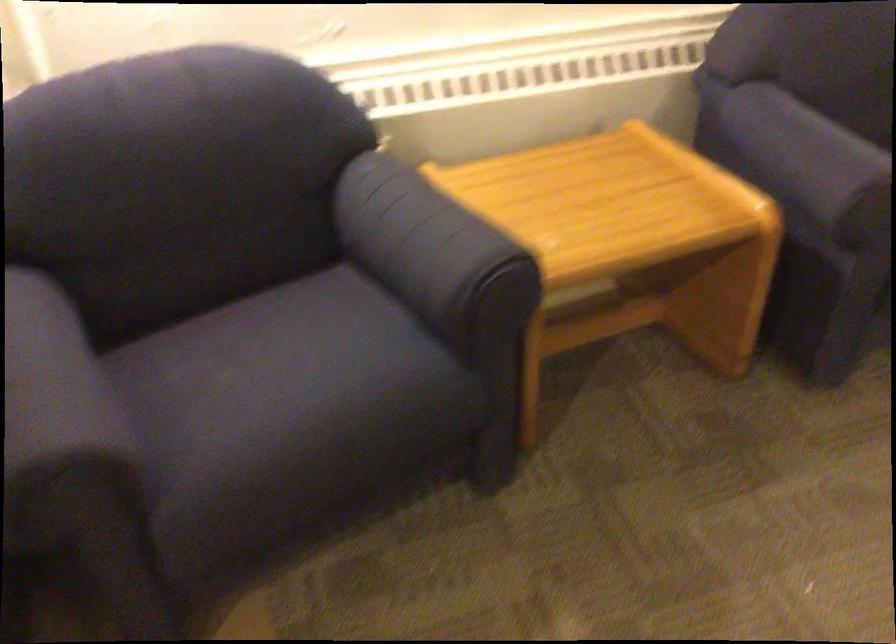
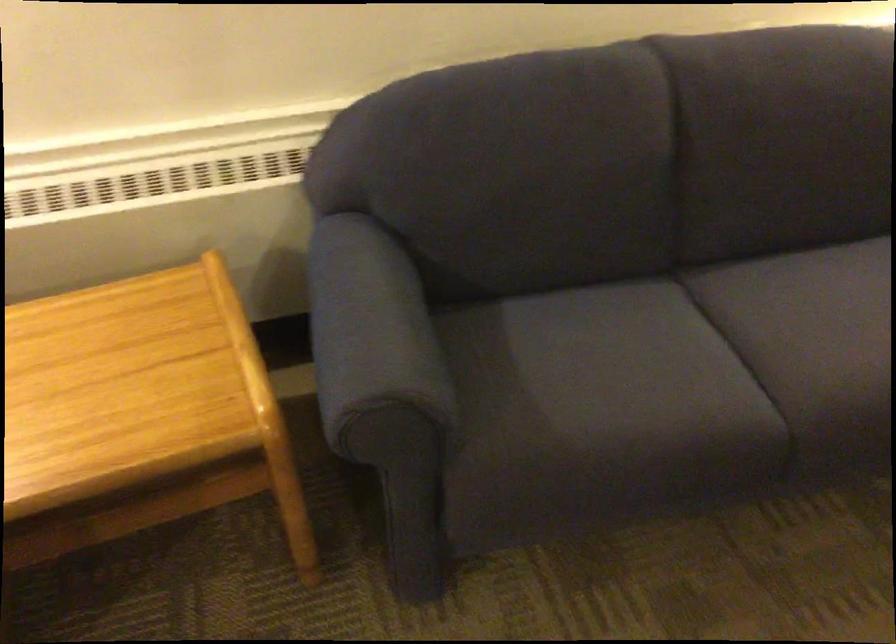
In a continuous first-person perspective shot, in which direction is the camera moving?

The cameraman walked toward right, forward.